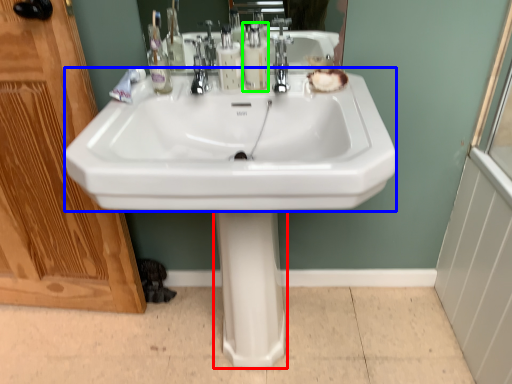
Question: Based on their relative distances, which object is farther from bidet (highlighted by a red box)? Choose from sink (highlighted by a blue box) and soap dispenser (highlighted by a green box).

Choices:
 (A) sink
 (B) soap dispenser

Answer: (B)